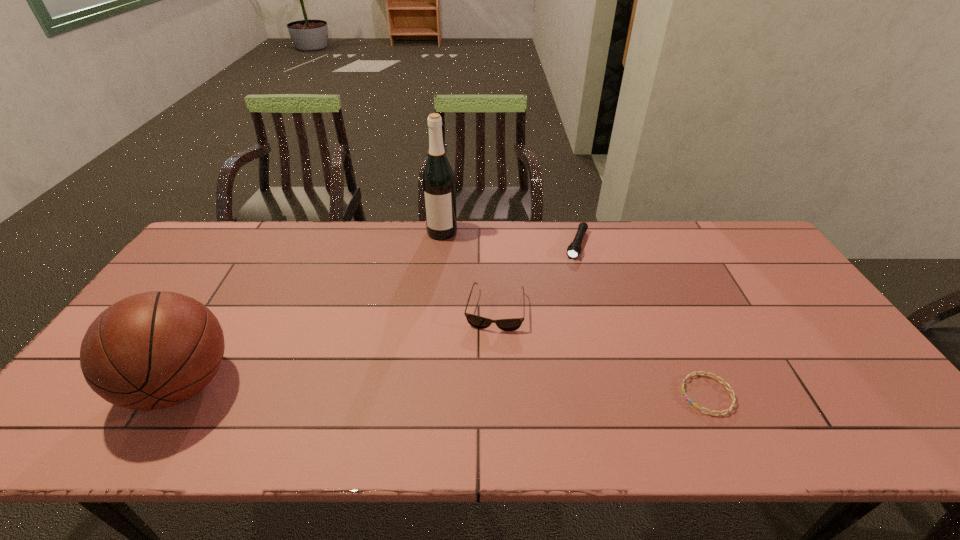
What are the coordinates of `free space on the desktop that is between the fourth shortest object and the shortest object and is positioned on the label of the tallest object` in the screenshot? It's located at (402, 389).

Locate an element on the screen. The width and height of the screenshot is (960, 540). vacant spot on the desktop that is between the leftmost object and the shortest object and is positioned at the lens end of the flashlight is located at coordinates (519, 391).

At what (x,y) coordinates should I click in order to perform the action: click on vacant spot on the desktop that is between the second tallest object and the shortest object and is positioned on the lenses of the third nearest object. Please return your answer as a coordinate pair (x, y). The width and height of the screenshot is (960, 540). Looking at the image, I should click on (483, 390).